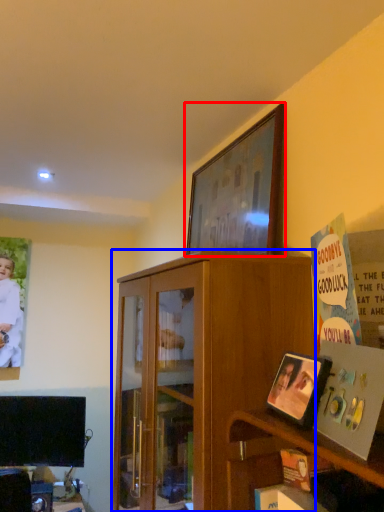
Question: Which of the following is the farthest to the observer, picture frame (highlighted by a red box) or cabinetry (highlighted by a blue box)?

Choices:
 (A) picture frame
 (B) cabinetry

Answer: (A)